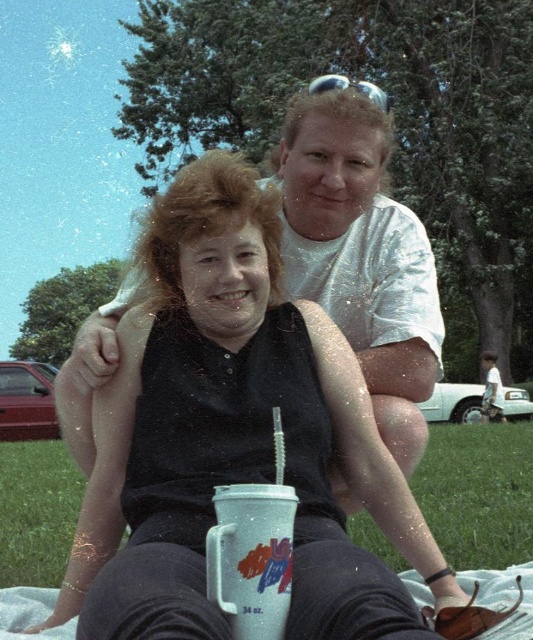
In the scene shown: You are planning to set up a small garden in your backyard. You have a space that can accommodate objects up to the size of the white plastic mug at center. Can the green grass at lower center fit in this space?

The green grass at lower center is larger in size than the white plastic mug at center, so it cannot fit in the space designated for the mug.